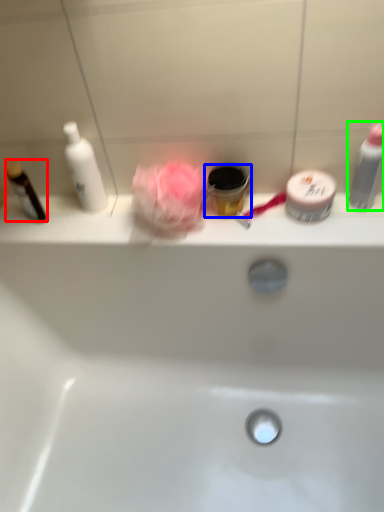
Question: Which object is positioned closest to toiletry (highlighted by a red box)? Select from toiletry (highlighted by a blue box) and toiletry (highlighted by a green box).

Choices:
 (A) toiletry
 (B) toiletry

Answer: (A)